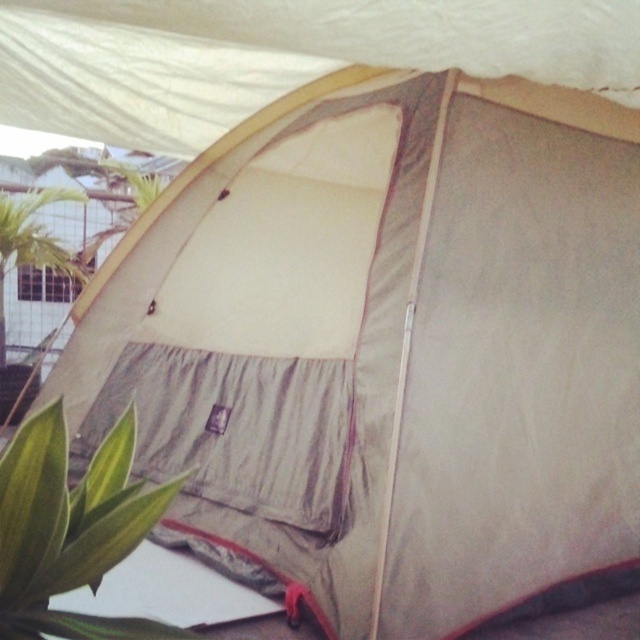
Which is more to the left, beige fabric tent at upper center or green leafy plant at lower left?

beige fabric tent at upper center

Between beige fabric tent at upper center and green leafy plant at lower left, which one is positioned lower?

Positioned lower is green leafy plant at lower left.

Does point (173, 80) come closer to viewer compared to point (84, 536)?

No, (173, 80) is further to viewer.

Where is `beige fabric tent at upper center`? This screenshot has height=640, width=640. beige fabric tent at upper center is located at coordinates [280, 54].

Between point (189, 97) and point (35, 202), which one is positioned behind?

The point (35, 202) is more distant.

Who is higher up, beige fabric tent at upper center or green leafy plant at left?

Positioned higher is beige fabric tent at upper center.

Who is more forward, (387,12) or (0,364)?

Positioned in front is point (387,12).

At what (x,y) coordinates should I click in order to perform the action: click on beige fabric tent at upper center. Please return your answer as a coordinate pair (x, y). The height and width of the screenshot is (640, 640). Looking at the image, I should click on (280, 54).

Measure the distance between green leafy plant at lower left and camera.

They are 5.24 feet apart.

Which is more to the right, green leafy plant at lower left or green leafy plant at upper left?

Positioned to the right is green leafy plant at lower left.

Where is `green leafy plant at lower left`? The width and height of the screenshot is (640, 640). green leafy plant at lower left is located at coordinates (70, 529).